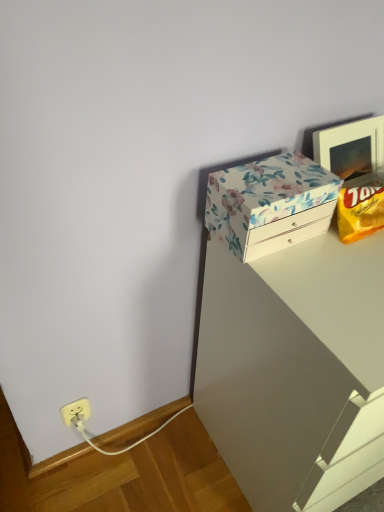
This screenshot has height=512, width=384. I want to click on free space in front of yellow matte chip bag at upper right, so click(353, 270).